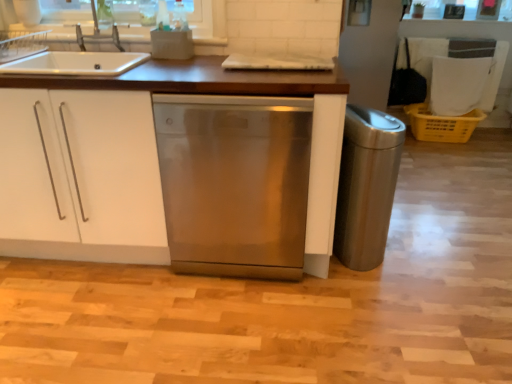
Identify the location of vacant space in front of stainless steel dishwasher at center. The image size is (512, 384). (236, 328).